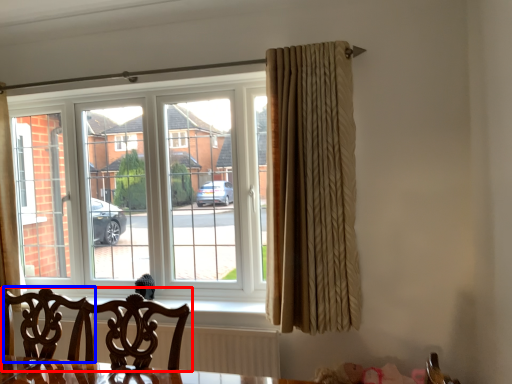
Question: Which point is closer to the camera, chair (highlighted by a red box) or swivel chair (highlighted by a blue box)?

Choices:
 (A) chair
 (B) swivel chair

Answer: (A)